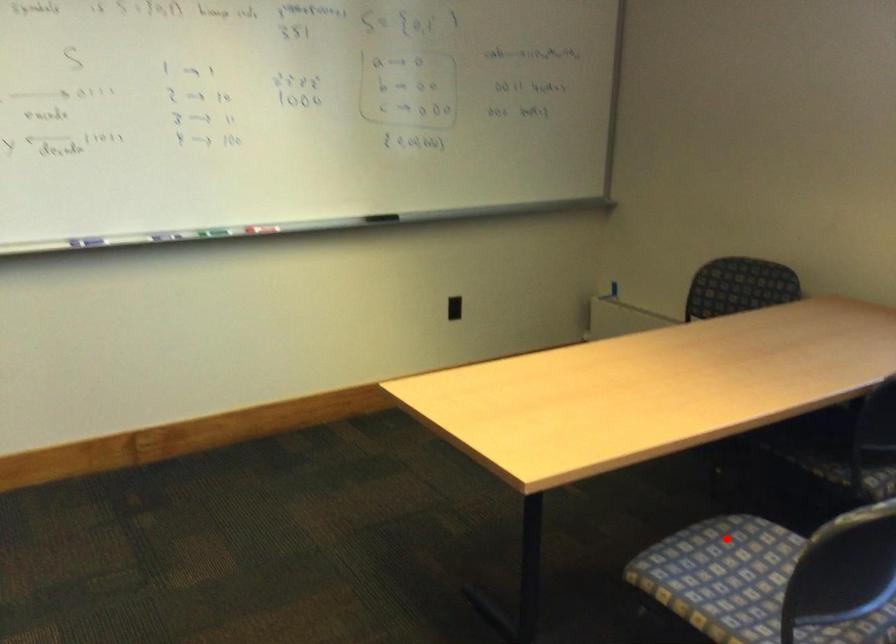
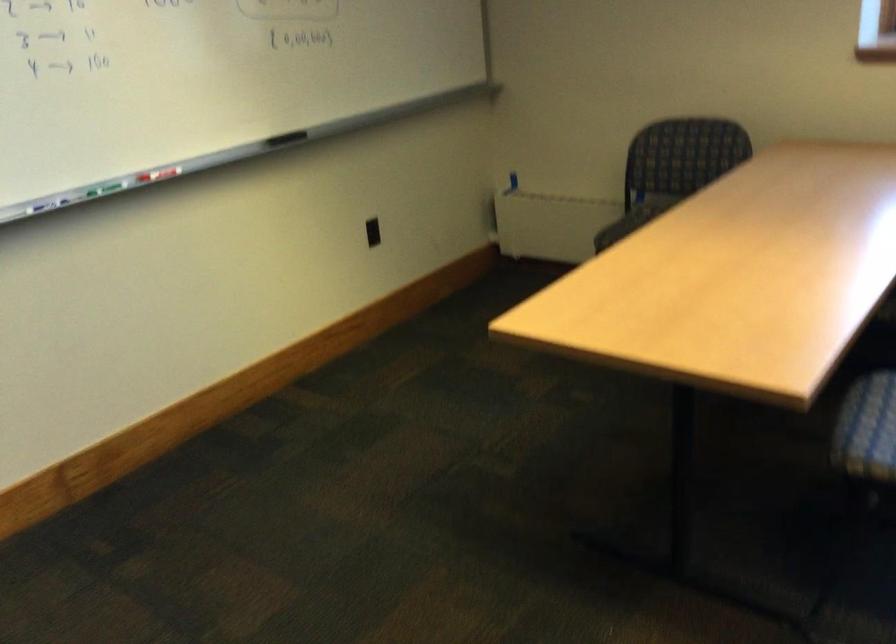
The point at the highlighted location is marked in the first image. Where is the corresponding point in the second image?

(875, 389)